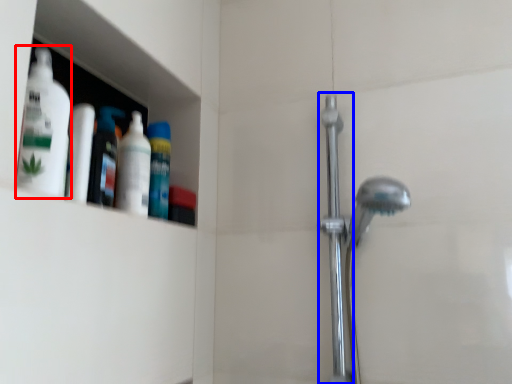
Question: Which of the following is the farthest to the observer, cleaning product (highlighted by a red box) or shower door (highlighted by a blue box)?

Choices:
 (A) cleaning product
 (B) shower door

Answer: (B)